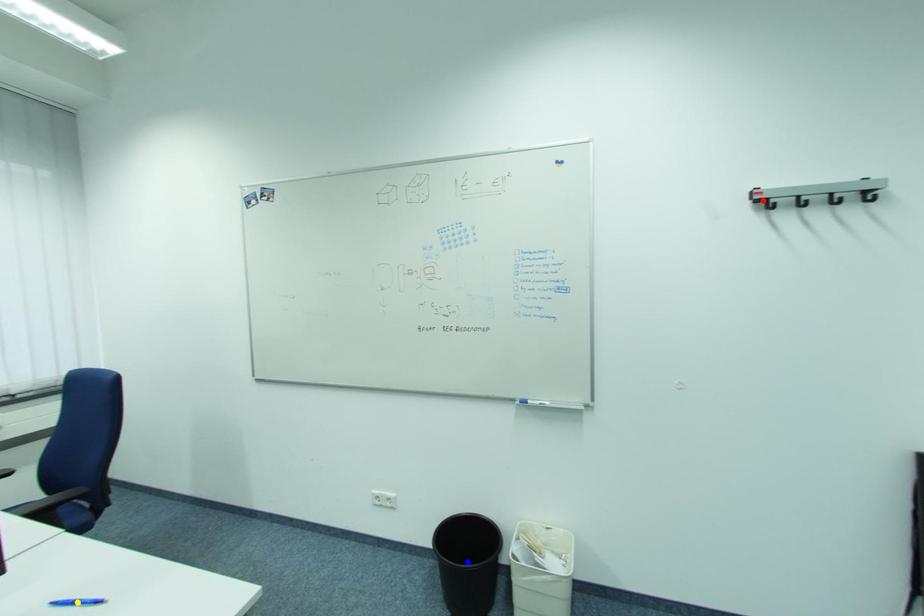
Order these from nearest to farthest:
1. blue point
2. red point
3. yellow point

yellow point < red point < blue point